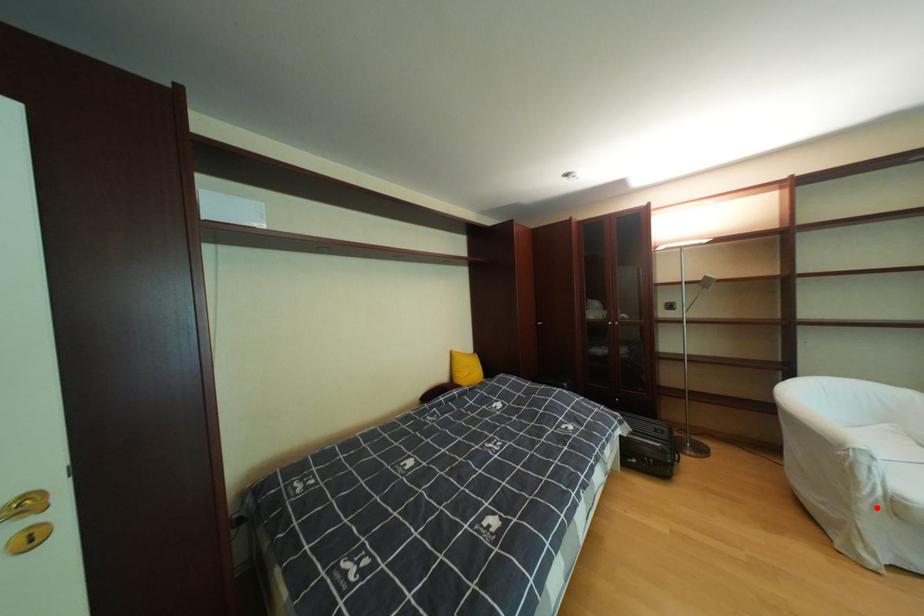
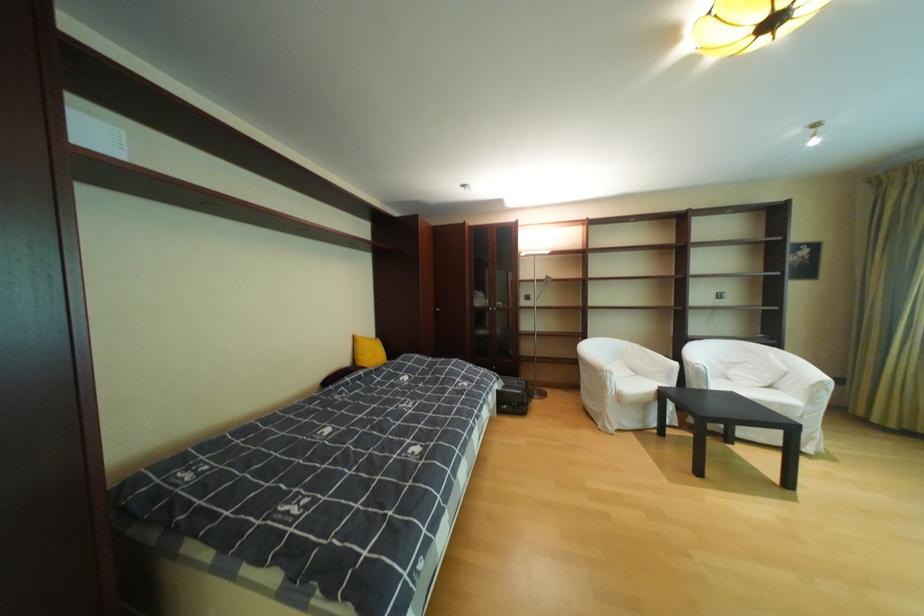
Question: I am providing you with two images of the same scene from different viewpoints. In image1, a red point is highlighted. Considering the same 3D point in image2, which of the following is correct?

Choices:
 (A) It is closer
 (B) It is farther

Answer: (B)